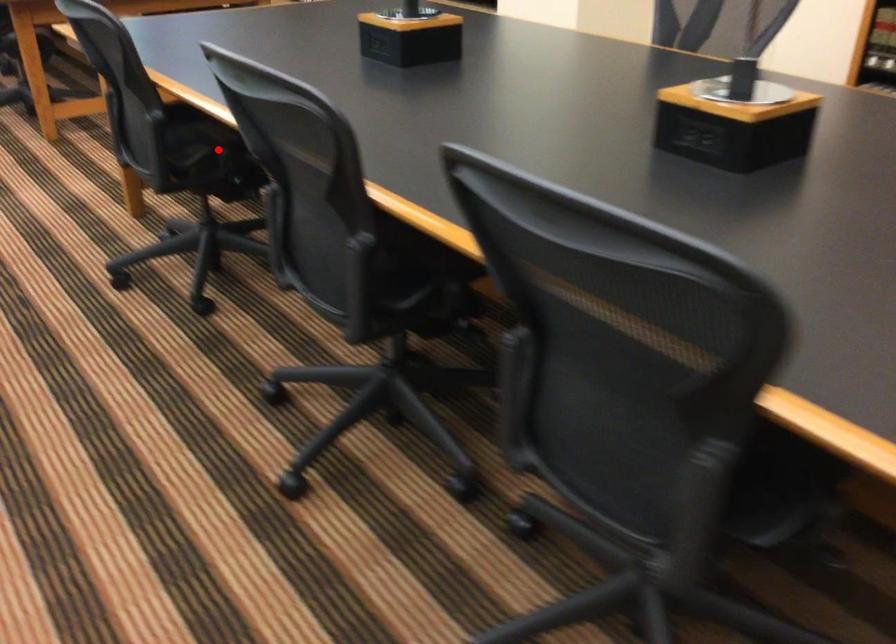
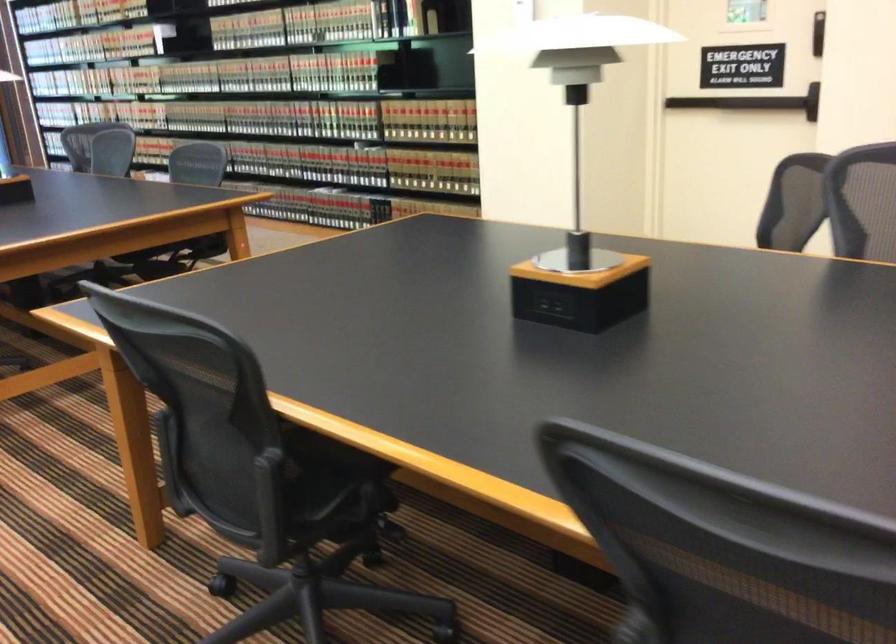
Question: I am providing you with two images of the same scene from different viewpoints. In image1, a red point is highlighted. Considering the same 3D point in image2, which of the following is correct?

Choices:
 (A) It is closer
 (B) It is farther

Answer: (A)